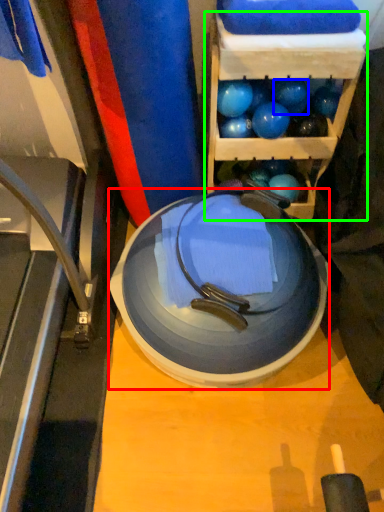
Question: Which is farther away from plate (highlighted by a red box)? ball (highlighted by a blue box) or shelf (highlighted by a green box)?

Choices:
 (A) ball
 (B) shelf

Answer: (A)